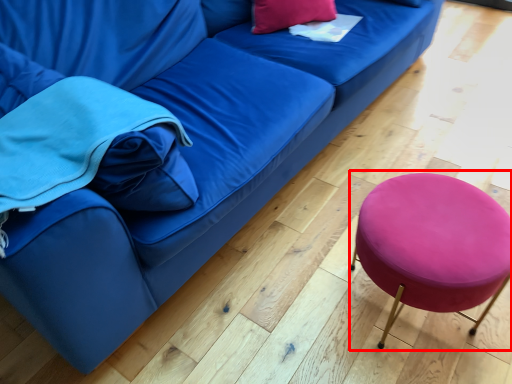
Question: From the image's perspective, where is bar stool (annotated by the red box) located relative to pillow?

Choices:
 (A) above
 (B) below

Answer: (B)